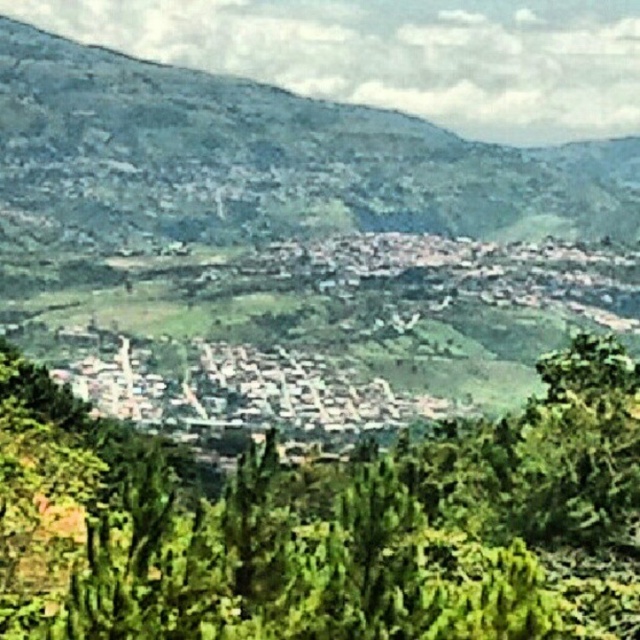
You are an environmental scientist studying the valley. You observe the green leafy tree at center and the green textured hillside at upper left. Which object is located to the left of the other?

The green leafy tree at center is positioned on the left side of green textured hillside at upper left.

You are a hiker standing in the valley and want to take a photo that captures both the green leafy tree at center and the white stone buildings at center. Which object should you position closer to the front of your photo to ensure both are fully visible?

Since the green leafy tree at center is taller than the white stone buildings at center, you should position the green leafy tree at center closer to the front of your photo to prevent it from overshadowing the buildings and ensure both are fully visible.

You are an architect planning to build a new observation deck in the valley. You want to ensure it offers a clear view of both the green textured hillside at upper left and the white stone buildings at center. Based on their positions, which object is higher in elevation?

The green textured hillside at upper left is above the white stone buildings at center, so it has a higher elevation.